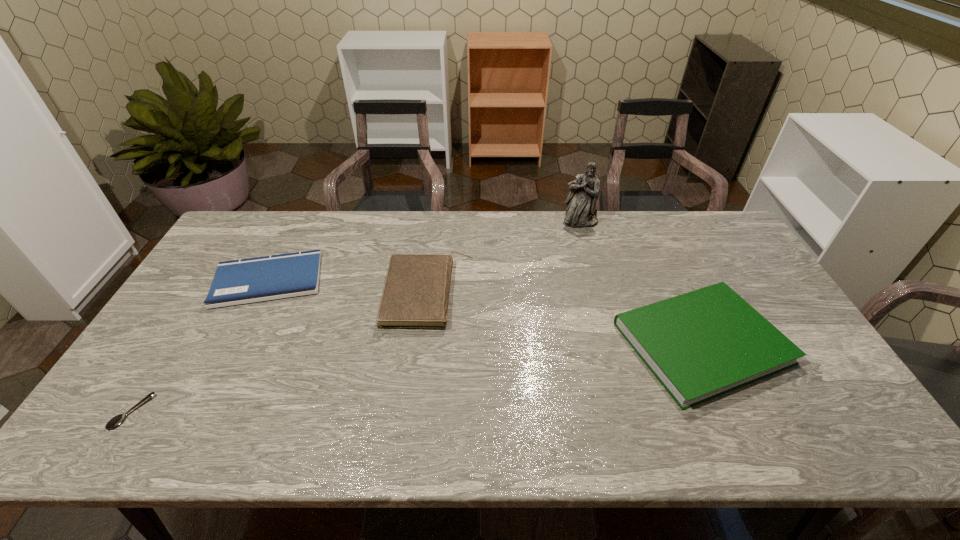
Image resolution: width=960 pixels, height=540 pixels. What are the coordinates of `free space at the far left corner of the desktop` in the screenshot? It's located at (233, 250).

At what (x,y) coordinates should I click in order to perform the action: click on free region at the near right corner of the desktop. Please return your answer as a coordinate pair (x, y). The image size is (960, 540). Looking at the image, I should click on [x=875, y=449].

Locate an element on the screen. Image resolution: width=960 pixels, height=540 pixels. empty space that is in between the rightmost paperback book and the soupspoon is located at coordinates (417, 377).

Find the location of `vacant space that is in between the rightmost paperback book and the soupspoon`. vacant space that is in between the rightmost paperback book and the soupspoon is located at coordinates (417, 377).

The width and height of the screenshot is (960, 540). I want to click on unoccupied area between the farthest object and the rightmost paperback book, so click(641, 282).

Identify the location of vacant space in between the farthest object and the rightmost paperback book. (641, 282).

At what (x,y) coordinates should I click in order to perform the action: click on blank region between the rightmost paperback book and the tallest object. Please return your answer as a coordinate pair (x, y). Looking at the image, I should click on (641, 282).

The width and height of the screenshot is (960, 540). Identify the location of unoccupied area between the second paperback book from right to left and the rightmost paperback book. (564, 318).

Find the location of a particular element. Image resolution: width=960 pixels, height=540 pixels. free point between the leftmost paperback book and the rightmost paperback book is located at coordinates (485, 312).

Identify the location of free space that is in between the farthest object and the second paperback book from right to left. (504, 258).